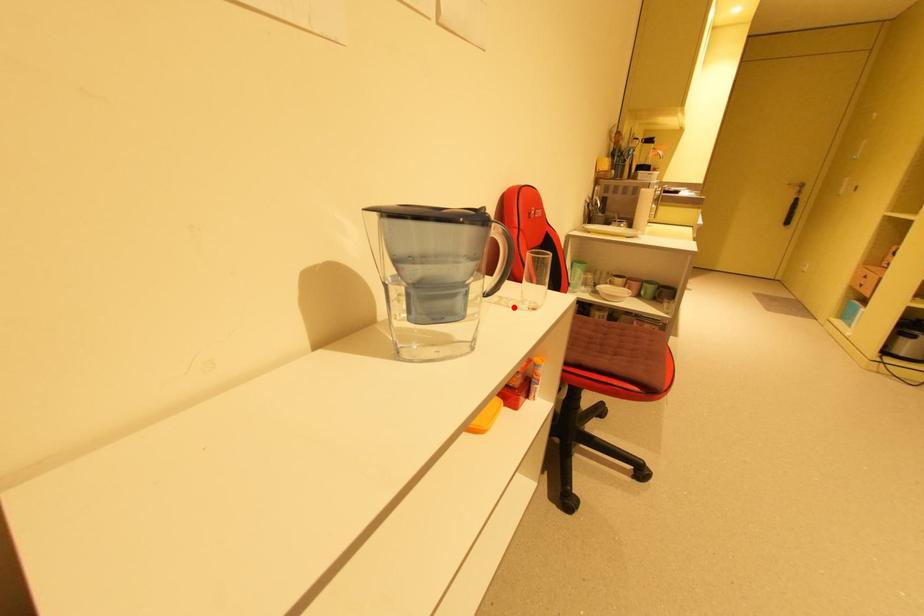
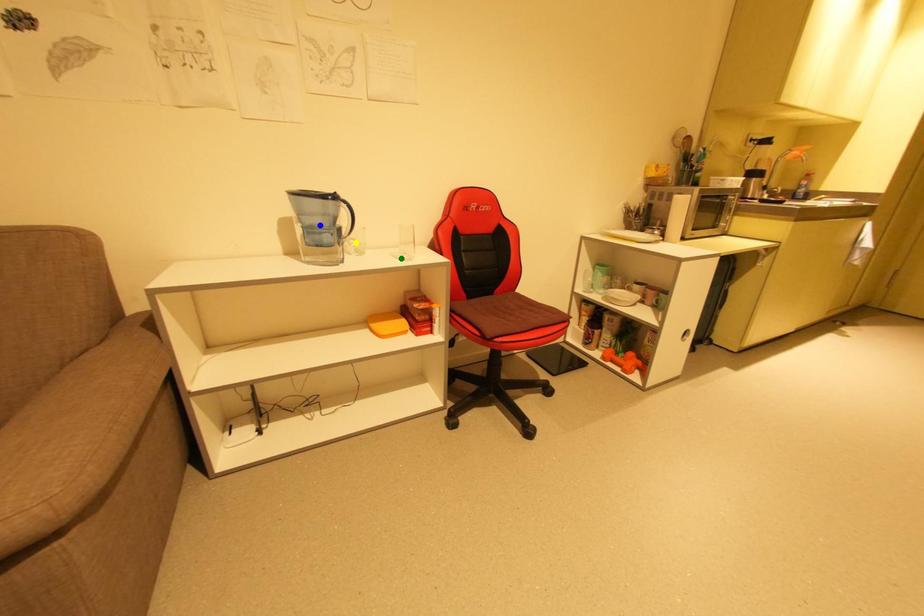
Question: I am providing you with two images of the same scene from different viewpoints. A red point is marked on the first image. You are given multiple points on the second image. Which point in image 2 is actually the same real-world point as the red point in image 1?

Choices:
 (A) green point
 (B) blue point
 (C) yellow point

Answer: (A)